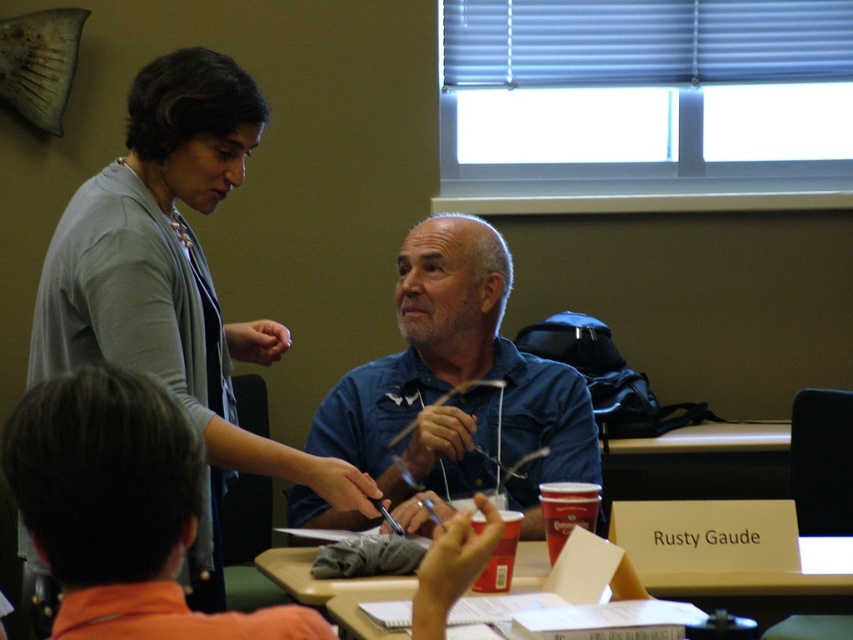
Consider the image. You are a photographer setting up a tripod in the room. You need to position it so that both the gray cardigan at upper left and the blue denim shirt at center are visible in the frame. Considering their heights, which object should be placed closer to the camera to ensure both are fully visible?

The gray cardigan at upper left is much taller than the blue denim shirt at center, so placing the gray cardigan at upper left closer to the camera will help ensure both are fully visible in the frame.